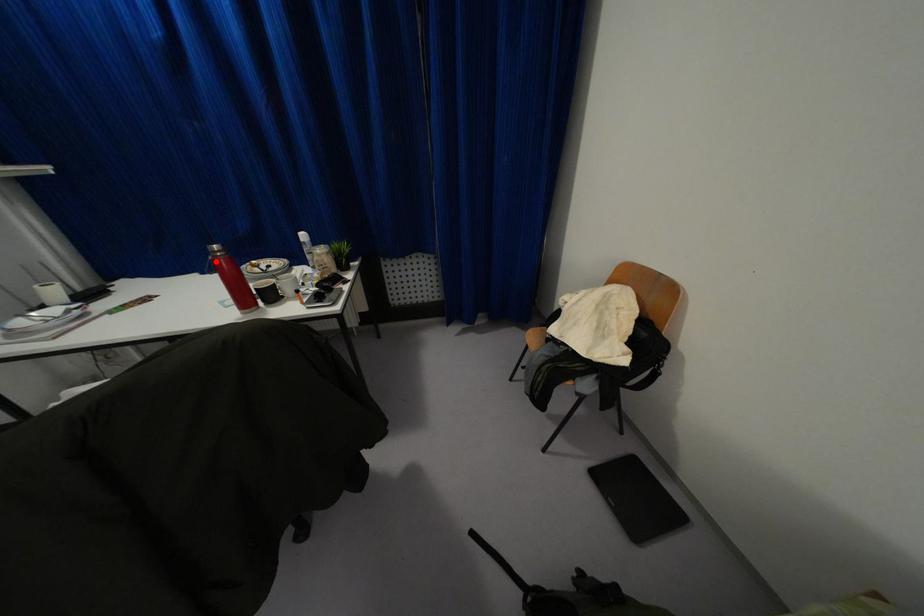
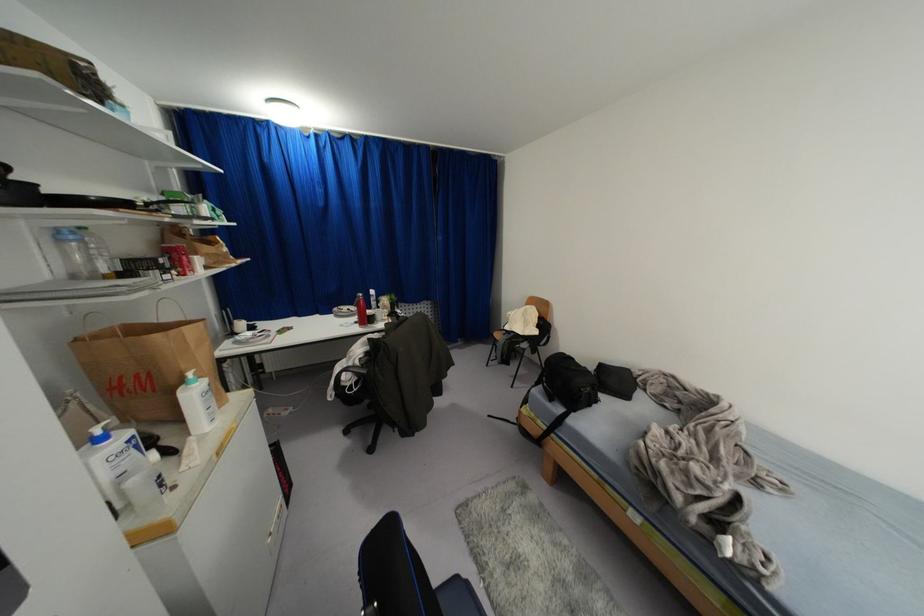
Locate, in the second image, the point that corresponds to the highlighted location in the first image.

(359, 301)